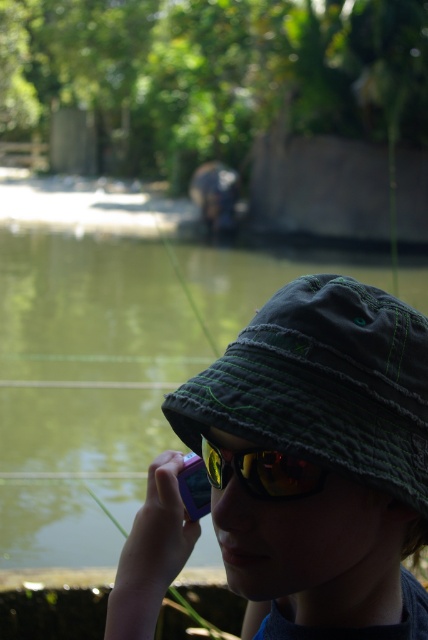
You are taking a photo of the matte green bucket hat at center and the yellow reflective lens at center. Which object is closer to the camera?

The matte green bucket hat at center is closer to the viewer than the yellow reflective lens at center, so it is closer to the camera.

You are a photographer trying to capture the rhinoceros in the background. You have a matte green bucket hat at center and a yellow reflective lens at center. Which object should you adjust to ensure the lens isn

The matte green bucket hat at center is wider than the yellow reflective lens at center. Since the bucket hat is wider, you should adjust the position of the matte green bucket hat at center to avoid blocking the lens.

You are standing at the point marked by coordinates point [344,481]. You want to take a photo of the rhinoceros in the background without moving your feet. Can you reach the camera to capture the shot?

The distance between point [344,481] and the camera is 24.99 inches. Since the camera is within arm reach, you can easily reach it to take the photo without moving your feet.